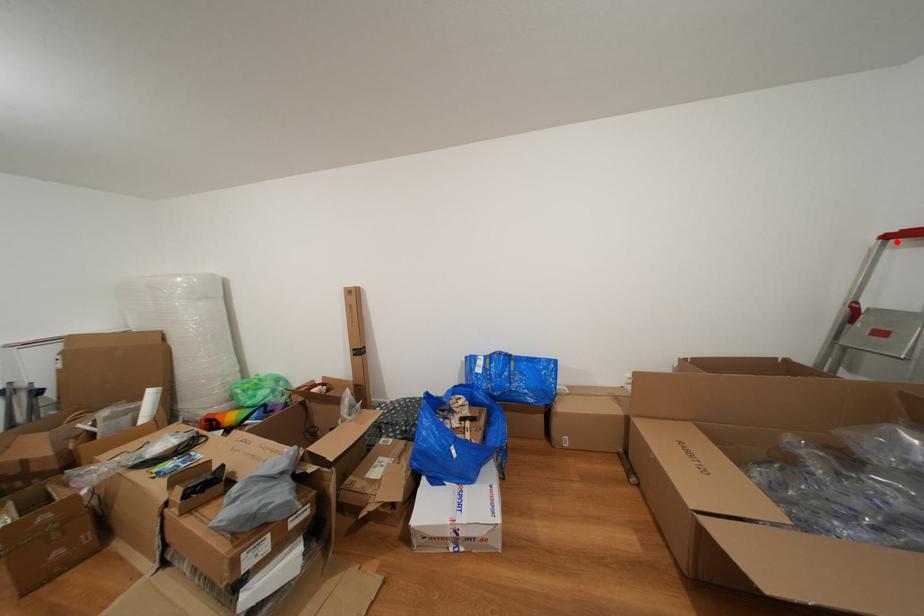
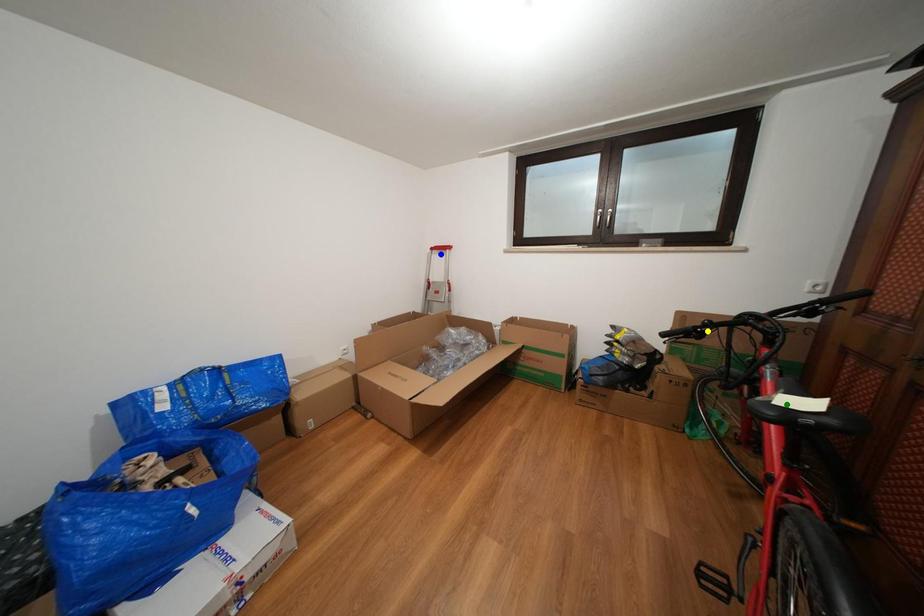
Question: I am providing you with two images of the same scene from different viewpoints. A red point is marked on the first image. You are given multiple points on the second image. Which spot in image 2 lines up with the point in image 1?

Choices:
 (A) yellow point
 (B) blue point
 (C) green point

Answer: (B)